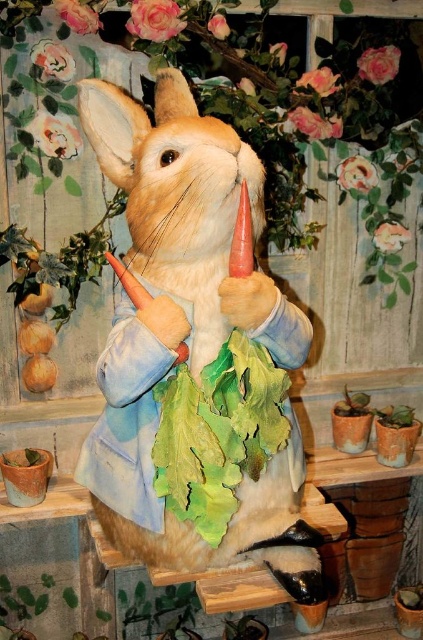
Is point (175, 429) positioned in front of point (241, 618)?

Yes, point (175, 429) is in front of point (241, 618).

Does fuzzy beige rabbit at center appear under green leafy plant at lower center?

No.

Which is behind, point (148, 172) or point (260, 637)?

Positioned behind is point (260, 637).

Image resolution: width=423 pixels, height=640 pixels. I want to click on fuzzy beige rabbit at center, so click(195, 353).